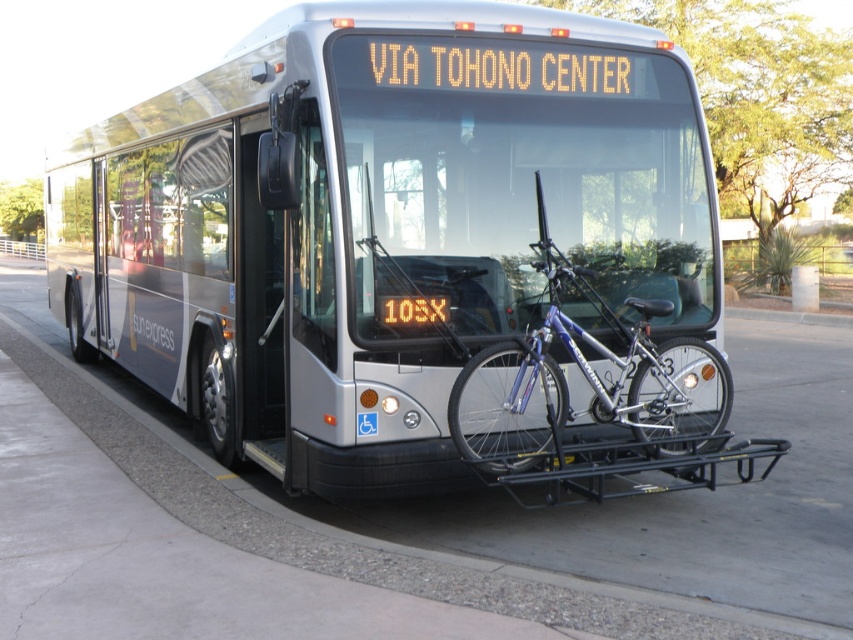
Does silver metallic bus at center have a larger size compared to silver metallic bicycle at center?

Indeed, silver metallic bus at center has a larger size compared to silver metallic bicycle at center.

Can you confirm if silver metallic bus at center is positioned below silver metallic bicycle at center?

No.

Between point (90, 180) and point (511, 380), which one is positioned behind?

The point (90, 180) is more distant.

Where is `silver metallic bus at center`? This screenshot has width=853, height=640. silver metallic bus at center is located at coordinates (375, 221).

Is silver metallic bus at center taller than gray concrete pavement at lower center?

Yes.

Find the location of `silver metallic bus at center`. silver metallic bus at center is located at coordinates (375, 221).

Measure the distance from gray concrete pavement at lower center to silver metallic bicycle at center.

gray concrete pavement at lower center is 1.76 meters away from silver metallic bicycle at center.

In the scene shown: Who is taller, gray concrete pavement at lower center or silver metallic bicycle at center?

silver metallic bicycle at center

Find the location of a particular element. The width and height of the screenshot is (853, 640). gray concrete pavement at lower center is located at coordinates click(x=544, y=508).

Identify the location of gray concrete pavement at lower center. (544, 508).